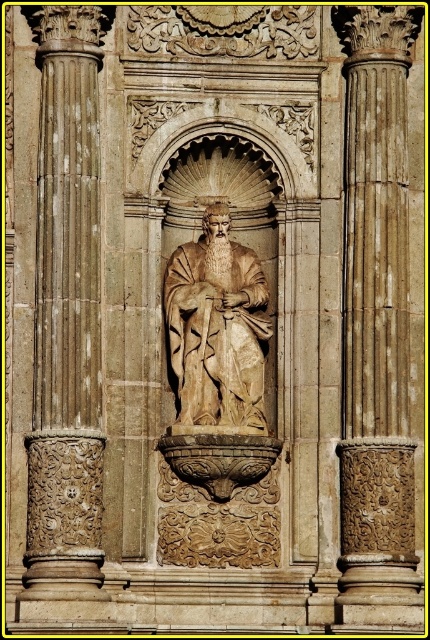
You are an art conservator assessing the structural integrity of the beige stone column at center and the beige stone statue at center. Given that the column is larger, which object might require more support to prevent collapse?

The beige stone column at center is larger in size than the beige stone statue at center, so it might require more support to prevent collapse due to its greater mass and potential structural demands.

You are an architect planning to install a protective glass panel between the carved stone column at center and the beige stone statue at center. The glass panel must be 6 meters long. Will the glass panel fit between them?

The carved stone column at center and beige stone statue at center are 5.84 meters apart. Since the glass panel is 6 meters long, which is longer than the distance between them, it will not fit between them.